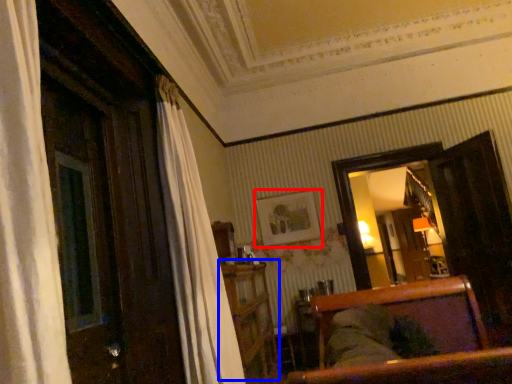
Question: Which of the following is the farthest to the observer, picture frame (highlighted by a red box) or dresser (highlighted by a blue box)?

Choices:
 (A) picture frame
 (B) dresser

Answer: (A)